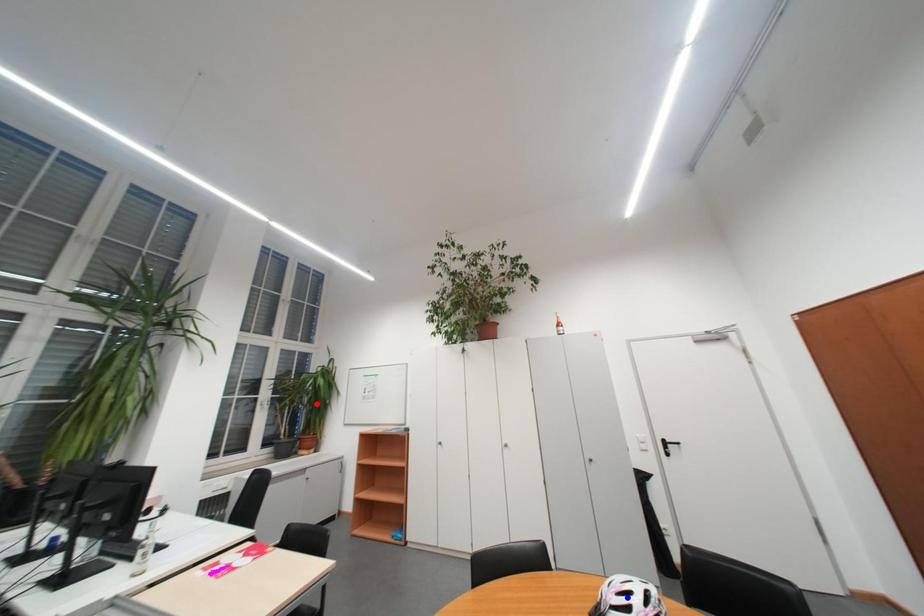
Question: Which of the two points in the image is closer to the camera?

Choices:
 (A) Blue point is closer.
 (B) Red point is closer.

Answer: (A)